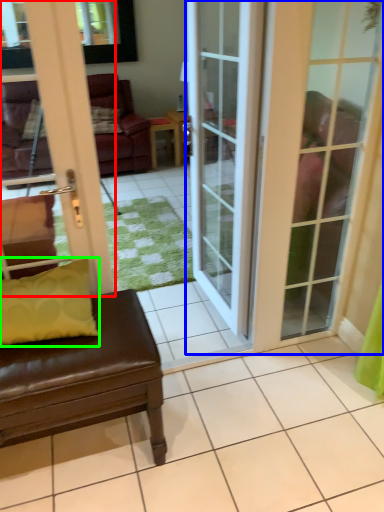
Question: Estimate the real-world distances between objects in this image. Which object is farther from door (highlighted by a red box), door (highlighted by a blue box) or pillow (highlighted by a green box)?

Choices:
 (A) door
 (B) pillow

Answer: (A)